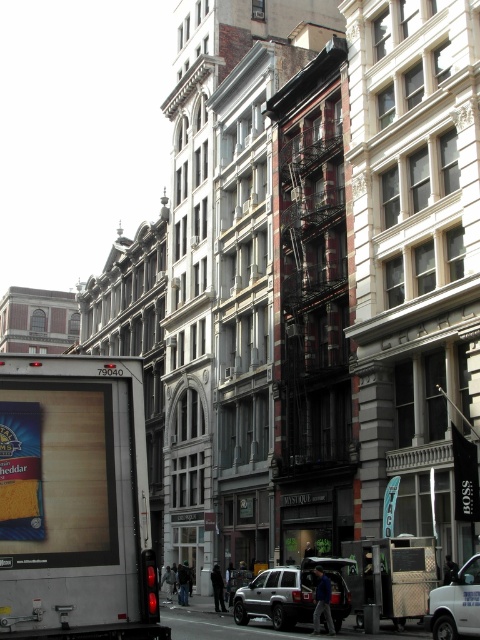
Question: Which point is farther from the camera taking this photo?

Choices:
 (A) (75, 509)
 (B) (36, 428)
 (C) (453, 580)
 (D) (263, 589)

Answer: (D)

Question: Considering the relative positions of yellow cheese at center and metallic silver van at center in the image provided, where is yellow cheese at center located with respect to metallic silver van at center?

Choices:
 (A) left
 (B) right

Answer: (A)

Question: Does yellow cheese at center have a lesser width compared to silver metallic suv at center?

Choices:
 (A) yes
 (B) no

Answer: (A)

Question: Which of these objects is positioned farthest from the silver metallic suv at center?

Choices:
 (A) yellow cheese at center
 (B) metallic silver van at center

Answer: (A)

Question: Which of the following is the closest to the observer?

Choices:
 (A) silver metallic suv at center
 (B) metallic silver van at center

Answer: (B)

Question: Considering the relative positions of yellow cheese at center and silver metallic suv at center in the image provided, where is yellow cheese at center located with respect to silver metallic suv at center?

Choices:
 (A) below
 (B) above

Answer: (B)